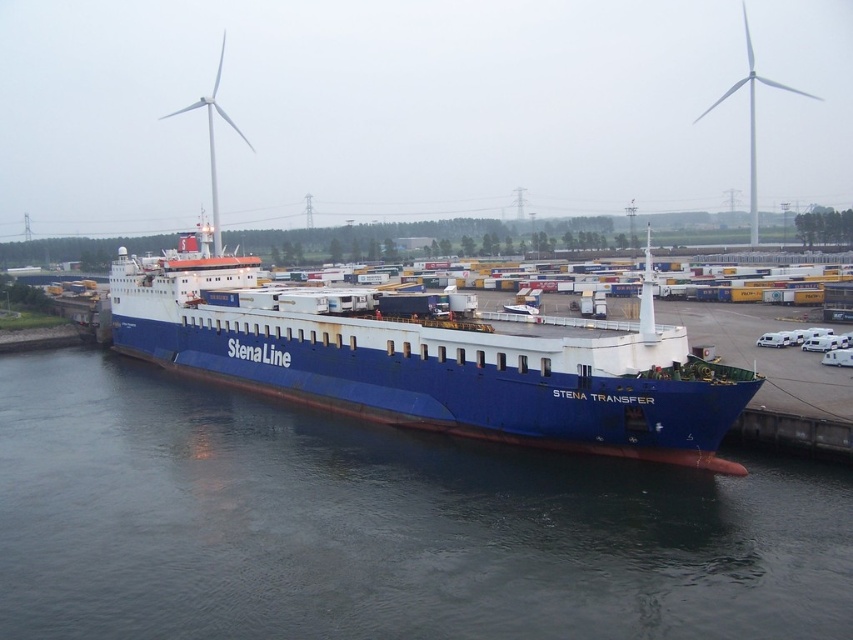
Who is positioned more to the left, blue metallic water at center or blue matte ship at center?

Positioned to the left is blue matte ship at center.

Is point (277, 497) farther from viewer compared to point (135, 284)?

No.

Where is `blue metallic water at center`? The height and width of the screenshot is (640, 853). blue metallic water at center is located at coordinates (379, 525).